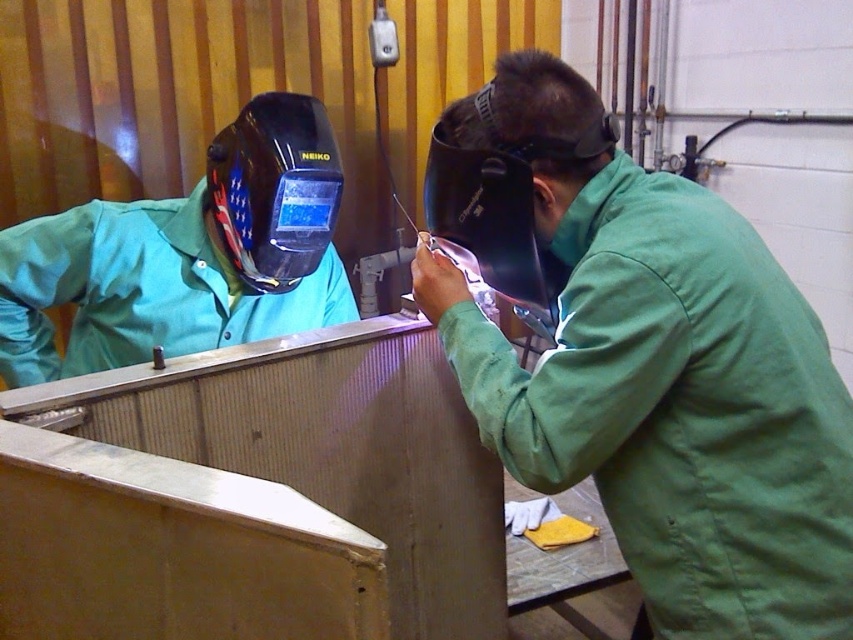
You are standing in the workshop and want to place a safety sign between the two points, point (662, 451) and point (322, 264). Which point is closer to you so you can place the sign there?

Point (662, 451) is closer to the camera than point (322, 264), so you should place the safety sign there.

You are a safety inspector in the workshop. You need to check the position of the green matte welding suit at center. What are its coordinates?

The coordinates of the green matte welding suit at center are at point [659,374].

You are a safety inspector in the workshop. You need to check the placement of the green matte welding suit at center and the matte black welding helmet at upper left. According to safety protocols, the welding suit should be placed to the left of the helmet. Is the current arrangement compliant with safety standards?

The green matte welding suit at center is to the right of the matte black welding helmet at upper left, so the current arrangement does not comply with safety standards which require the welding suit to be placed to the left of the helmet.